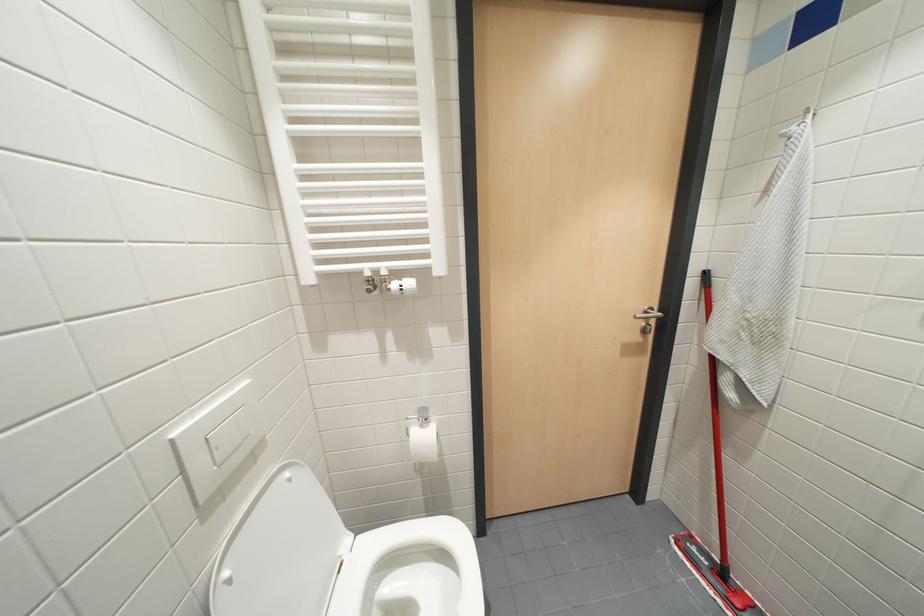
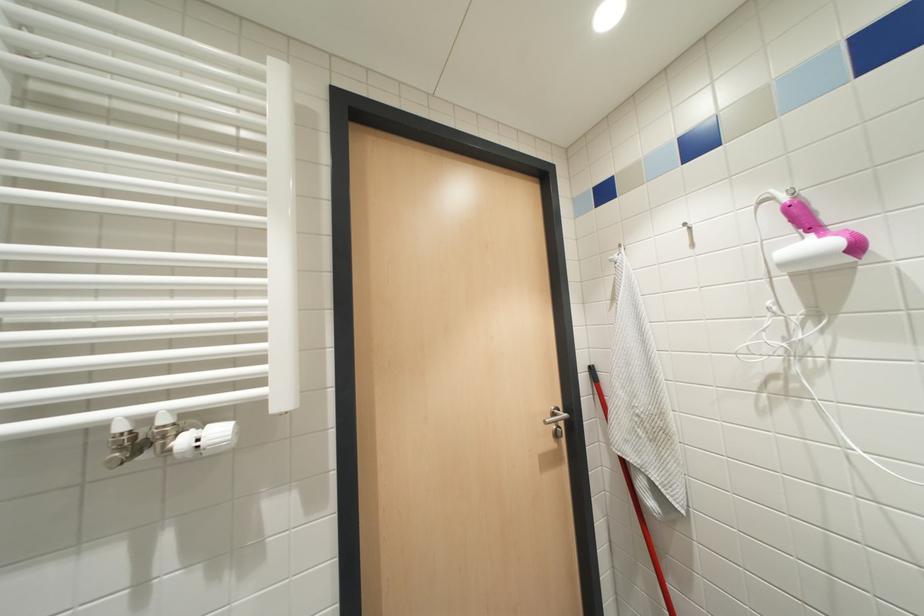
In a continuous first-person perspective shot, in which direction is the camera moving?

The movement direction of the cameraman is right, forward.